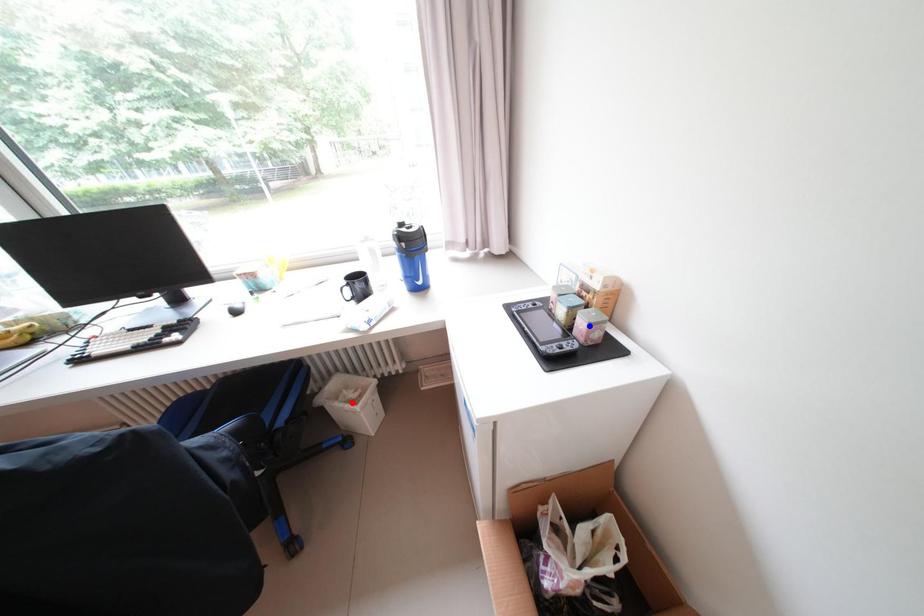
Question: Two points are marked on the image. Which point is closer to the camera?

Choices:
 (A) Blue point is closer.
 (B) Red point is closer.

Answer: (A)